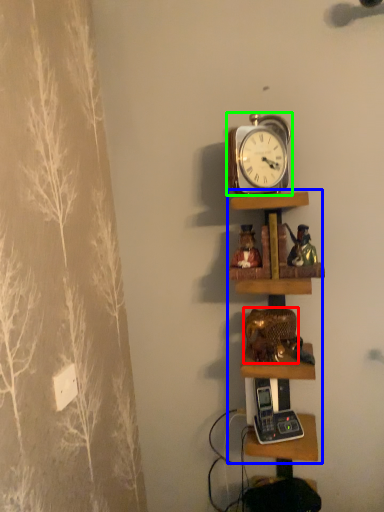
Question: Which is nearer to the toy (highlighted by a red box)? shelf (highlighted by a blue box) or alarm clock (highlighted by a green box).

Choices:
 (A) shelf
 (B) alarm clock

Answer: (A)